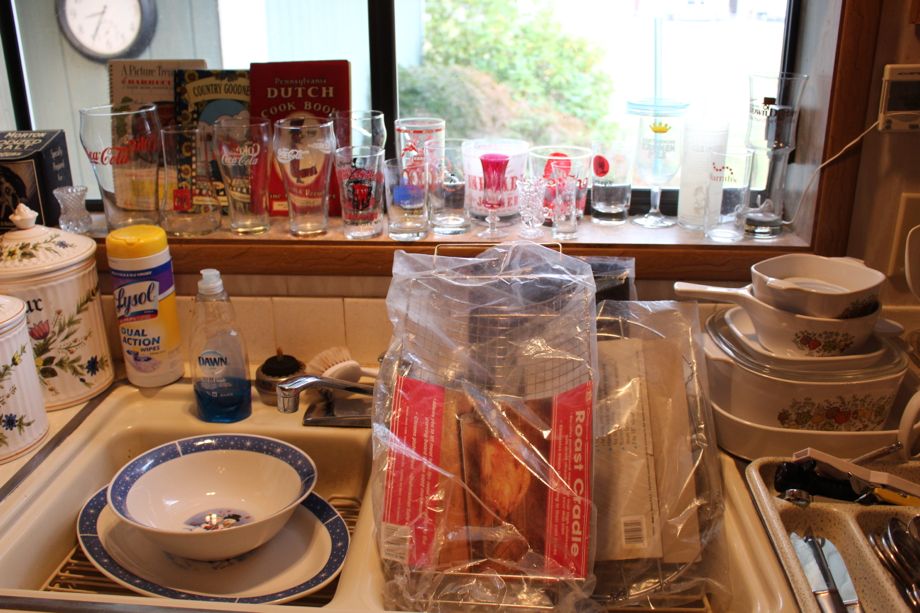
At what (x,y) coordinates should I click in order to perform the action: click on cleaning products. Please return your answer as a coordinate pair (x, y). The width and height of the screenshot is (920, 613). Looking at the image, I should click on (221, 370), (141, 319).